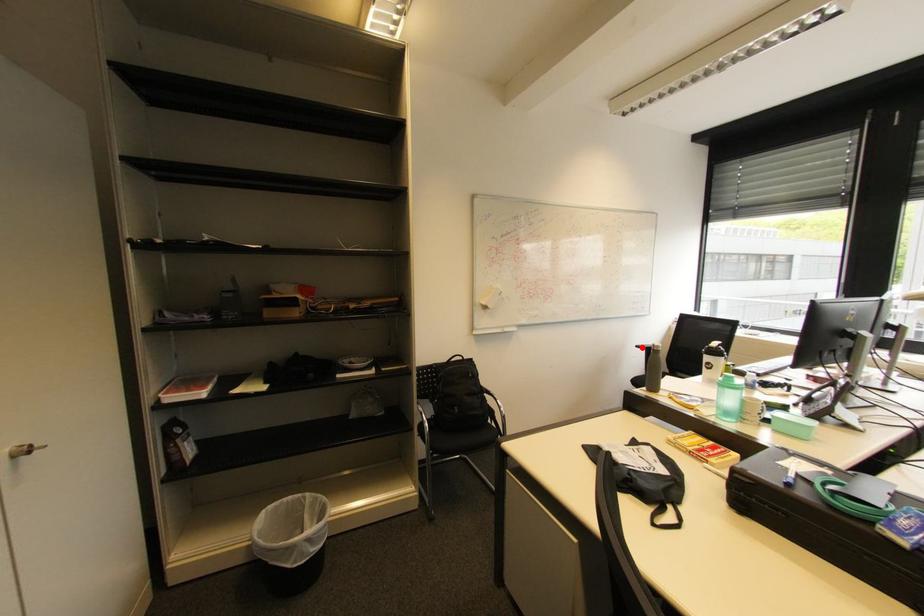
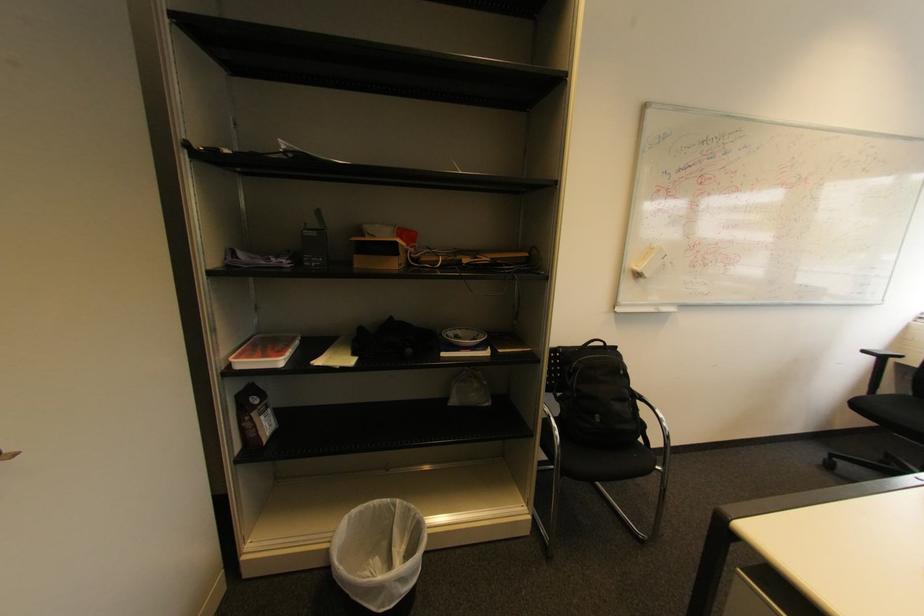
Question: I am providing you with two images of the same scene from different viewpoints. Image1 has a red point marked. In image2, the corresponding 3D location appears at what relative position? Reply with the corresponding letter.

Choices:
 (A) Closer
 (B) Farther

Answer: (B)